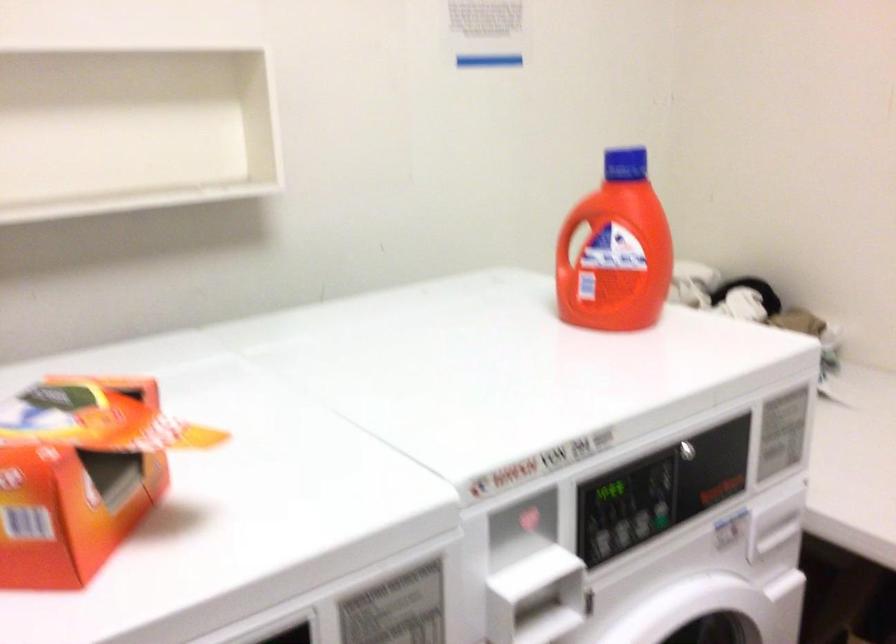
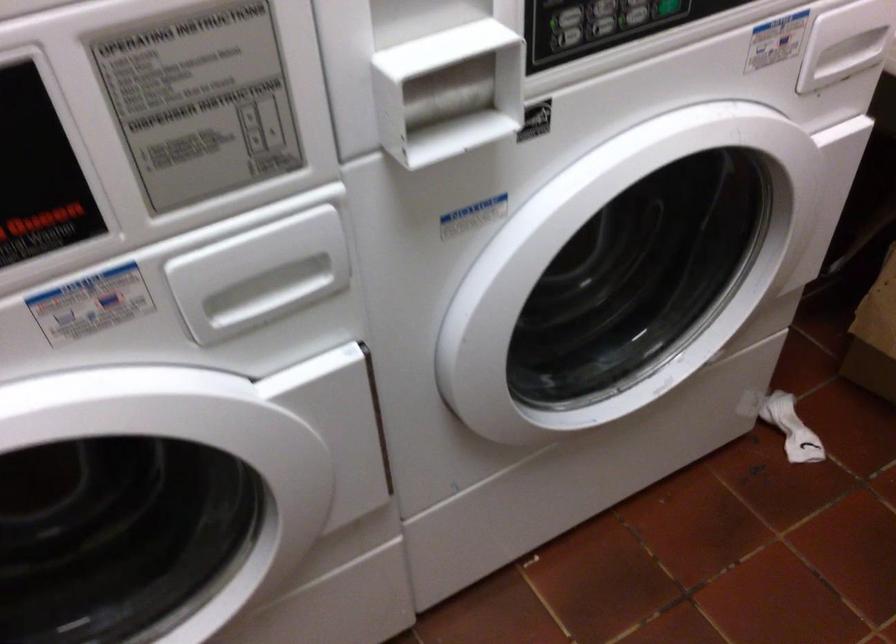
Question: Based on the continuous images, in which direction is the camera rotating? Reply with the corresponding letter.

Choices:
 (A) Left
 (B) Right
 (C) Up
 (D) Down

Answer: (D)